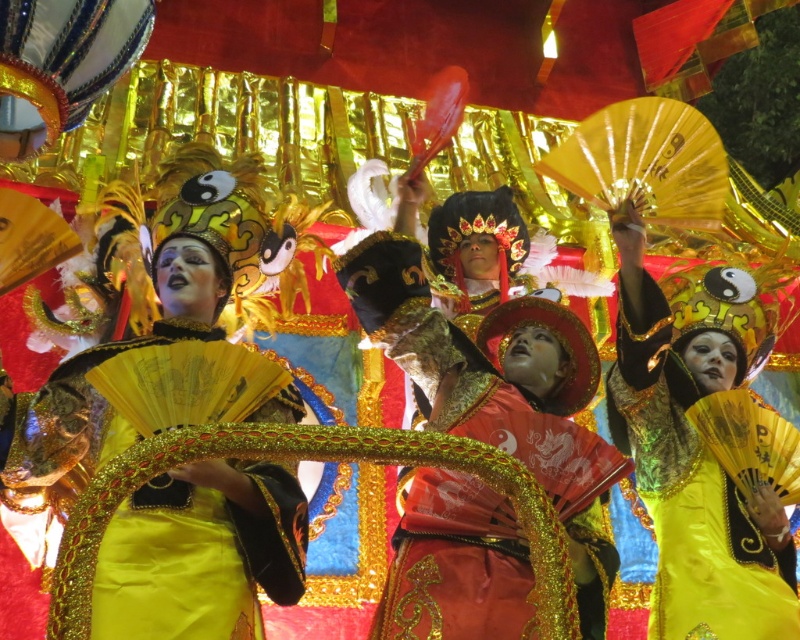
You are a photographer standing at the edge of the parade area. You want to capture a photo that includes both the shiny gold fabric at center and the shiny red fabric at center. Given that your camera has a maximum focus range of 30 feet, will you be able to fit both fabrics into the frame without moving closer?

The shiny gold fabric at center and shiny red fabric at center are 30.48 feet apart from each other. Since 30.48 feet exceeds the camera maximum focus range of 30 feet, you cannot fit both fabrics into the frame without moving closer.

You are an observer standing in front of the scene. There is a point marked at coordinates point [698,461]. What object in the scene is located at this point?

The shiny yellow fabric at center is located at point [698,461].